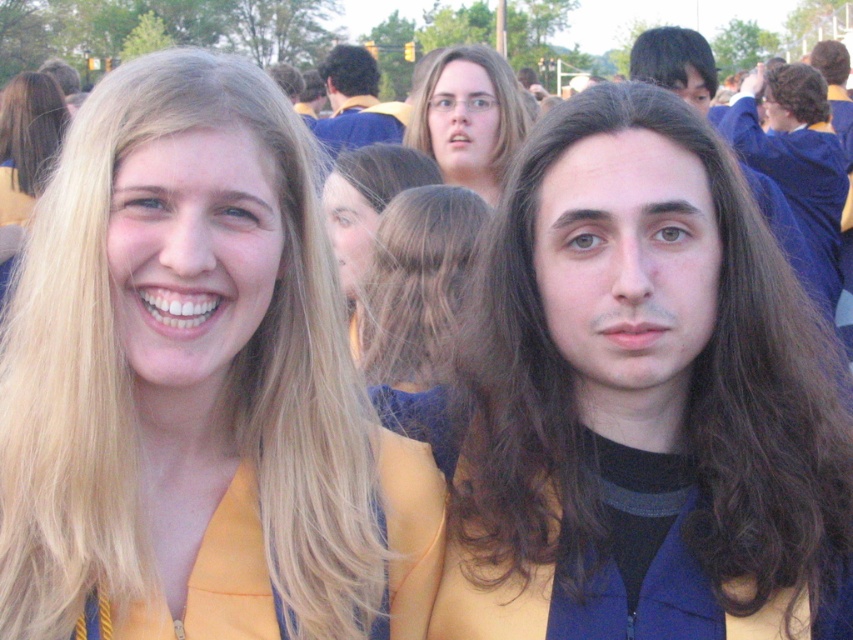
You are a photographer at the graduation ceremony. You want to capture a closeup shot of the blonde silky hair at upper left. The camera is currently focused on the point at point (32, 129). Will this point be on the blonde silky hair at upper left?

The point (32, 129) is on the blonde silky hair at upper left, so yes, the camera is focused on the correct area.

You are a photographer at the graduation ceremony and want to capture a photo that includes both the blonde hair at center and the blonde hair at upper right. Given that your camera has a maximum focus range of 15 feet, will you be able to fit both subjects in the frame without moving closer?

The distance between the blonde hair at center and the blonde hair at upper right is 15.34 feet. Since the camera can only focus up to 15 feet, the subjects are slightly out of range. You may need to move closer to ensure both are within the 15 feet focus range.